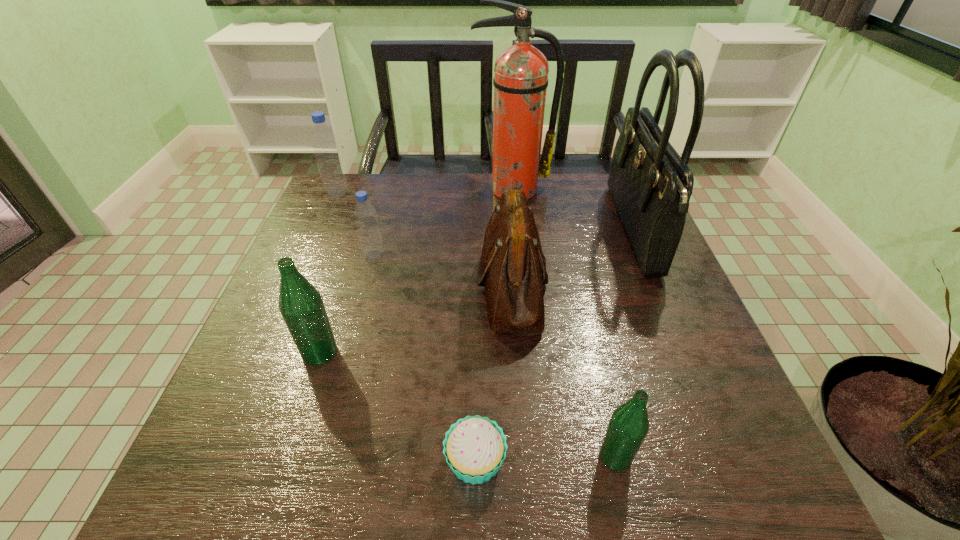
Image resolution: width=960 pixels, height=540 pixels. Find the location of `the smaller green bottle`. the smaller green bottle is located at coordinates (629, 424).

Locate an element on the screen. The width and height of the screenshot is (960, 540). the right green bottle is located at coordinates (629, 424).

You are a GUI agent. You are given a task and a screenshot of the screen. Output one action in this format:
    pyautogui.click(x=<x>, y=<y>)
    Task: Click on the shortest object
    
    Given the screenshot: What is the action you would take?
    pyautogui.click(x=474, y=447)

In order to click on white cupcake in this screenshot , I will do `click(474, 447)`.

Locate an element on the screen. vacant position located 0.050m at the nozzle of the fire extinguisher is located at coordinates (514, 212).

The image size is (960, 540). Identify the location of free space located 0.190m with an open clasp on the front of the handbag. (546, 231).

You are a GUI agent. You are given a task and a screenshot of the screen. Output one action in this format:
    pyautogui.click(x=<x>, y=<y>)
    Task: Click on the vacant area situated 0.390m with an open clasp on the front of the handbag
    This screenshot has width=960, height=540.
    Given the screenshot: What is the action you would take?
    pyautogui.click(x=471, y=231)

Image resolution: width=960 pixels, height=540 pixels. In order to click on vacant space located with an open clasp on the front of the handbag in this screenshot , I will do pyautogui.click(x=516, y=231).

This screenshot has width=960, height=540. In order to click on free space located 0.330m on the front of the leftmost bottle in this screenshot , I will do `click(300, 276)`.

You are a GUI agent. You are given a task and a screenshot of the screen. Output one action in this format:
    pyautogui.click(x=<x>, y=<y>)
    Task: Click on the free space located on the right of the farther green bottle
    
    Given the screenshot: What is the action you would take?
    pyautogui.click(x=439, y=353)